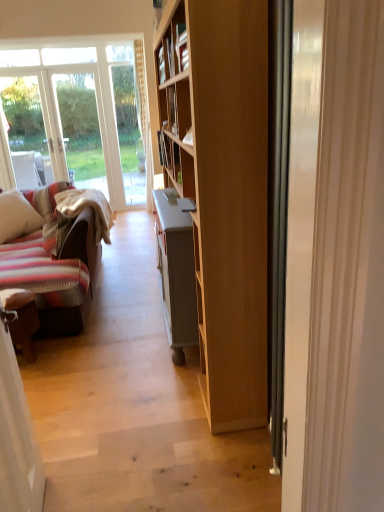
What do you see at coordinates (335, 260) in the screenshot? The width and height of the screenshot is (384, 512). I see `white glossy door at right` at bounding box center [335, 260].

At what (x,y) coordinates should I click in order to perform the action: click on white glossy door at right. Please return your answer as a coordinate pair (x, y). Image resolution: width=384 pixels, height=512 pixels. Looking at the image, I should click on (335, 260).

From the picture: Considering the sizes of objects white glossy door at right and brown leather chair at lower left in the image provided, who is shorter, white glossy door at right or brown leather chair at lower left?

brown leather chair at lower left.

Based on their sizes in the image, would you say white glossy door at right is bigger or smaller than brown leather chair at lower left?

Clearly, white glossy door at right is larger in size than brown leather chair at lower left.

Is white glossy door at right facing towards brown leather chair at lower left?

No, white glossy door at right is not turned towards brown leather chair at lower left.

Is brown leather chair at lower left located within white glossy door at right?

Definitely not — brown leather chair at lower left is not inside white glossy door at right.

Considering their positions, is white glossy door at right located in front of or behind striped fabric pillow at left?

In the image, white glossy door at right appears in front of striped fabric pillow at left.

Considering the positions of points (310, 4) and (1, 206), is point (310, 4) farther from camera compared to point (1, 206)?

No, it is in front of (1, 206).

Can you tell me how much white glossy door at right and striped fabric pillow at left differ in facing direction?

The angle between the facing direction of white glossy door at right and the facing direction of striped fabric pillow at left is 113 degrees.

From a real-world perspective, who is located lower, brown leather chair at lower left or white glossy door at right?

brown leather chair at lower left.

Could you tell me if brown leather chair at lower left is turned towards white glossy door at right?

No.

From the image's perspective, is brown leather chair at lower left above or below white glossy door at right?

Clearly, from the image's perspective, brown leather chair at lower left is below white glossy door at right.

Is brown leather chair at lower left not close to white glossy door at right?

Indeed, brown leather chair at lower left is not near white glossy door at right.

Which object is positioned more to the right, brown leather chair at lower left or striped fabric pillow at left?

From the viewer's perspective, brown leather chair at lower left appears more on the right side.

Are brown leather chair at lower left and striped fabric pillow at left making contact?

There is a gap between brown leather chair at lower left and striped fabric pillow at left.

Between brown leather chair at lower left and striped fabric pillow at left, which one has larger size?

striped fabric pillow at left is bigger.

Where is `chair in front of the striped fabric pillow at left`? chair in front of the striped fabric pillow at left is located at coordinates (22, 320).

What's the angular difference between striped fabric pillow at left and brown leather chair at lower left's facing directions?

The angle between the facing direction of striped fabric pillow at left and the facing direction of brown leather chair at lower left is 27.7 degrees.

Considering the sizes of objects striped fabric pillow at left and brown leather chair at lower left in the image provided, who is shorter, striped fabric pillow at left or brown leather chair at lower left?

brown leather chair at lower left is shorter.

Who is more distant, striped fabric pillow at left or brown leather chair at lower left?

striped fabric pillow at left.

In terms of size, does striped fabric pillow at left appear bigger or smaller than brown leather chair at lower left?

striped fabric pillow at left is bigger than brown leather chair at lower left.

Is striped fabric pillow at left turned away from white glossy door at right?

striped fabric pillow at left does not have its back to white glossy door at right.

Are striped fabric pillow at left and white glossy door at right making contact?

There is a gap between striped fabric pillow at left and white glossy door at right.

Which is further, (6, 222) or (382, 255)?

The point (6, 222) is behind.

Which of these two, striped fabric pillow at left or white glossy door at right, stands taller?

white glossy door at right is taller.

Find the location of a particular element. The height and width of the screenshot is (512, 384). chair to the left of white glossy door at right is located at coordinates (22, 320).

Identify the location of door above the striped fabric pillow at left (from a real-world perspective). [335, 260].

Considering their positions, is striped fabric pillow at left positioned closer to brown leather chair at lower left than white glossy door at right?

striped fabric pillow at left lies closer to brown leather chair at lower left than the other object.

Considering their positions, is white glossy door at right positioned further to striped fabric pillow at left than brown leather chair at lower left?

white glossy door at right.

Based on their spatial positions, is brown leather chair at lower left or striped fabric pillow at left closer to white glossy door at right?

brown leather chair at lower left lies closer to white glossy door at right than the other object.

From the image, which object appears to be nearer to striped fabric pillow at left, brown leather chair at lower left or white glossy door at right?

brown leather chair at lower left is positioned closer to the anchor striped fabric pillow at left.

From the picture: Estimate the real-world distances between objects in this image. Which object is further from brown leather chair at lower left, white glossy door at right or striped fabric pillow at left?

white glossy door at right is further to brown leather chair at lower left.

Which object lies further to the anchor point white glossy door at right, striped fabric pillow at left or brown leather chair at lower left?

striped fabric pillow at left is further to white glossy door at right.

Image resolution: width=384 pixels, height=512 pixels. I want to click on chair located between white glossy door at right and striped fabric pillow at left in the depth direction, so click(x=22, y=320).